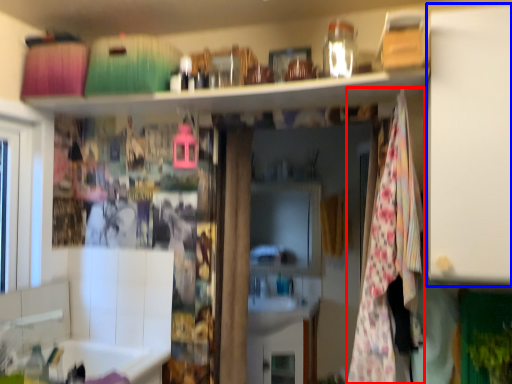
Question: Which object appears farthest to the camera in this image, blanket (highlighted by a red box) or cabinet (highlighted by a blue box)?

Choices:
 (A) blanket
 (B) cabinet

Answer: (A)